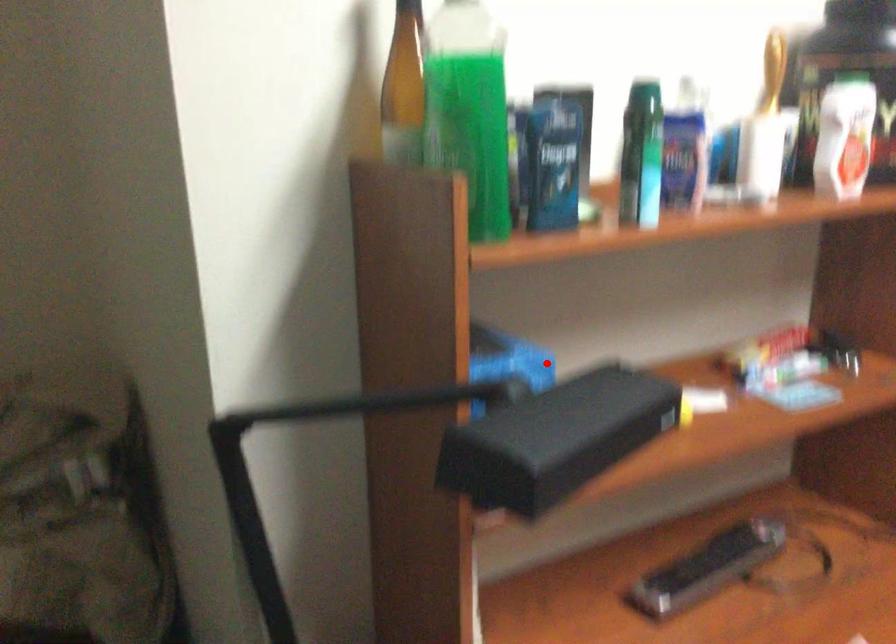
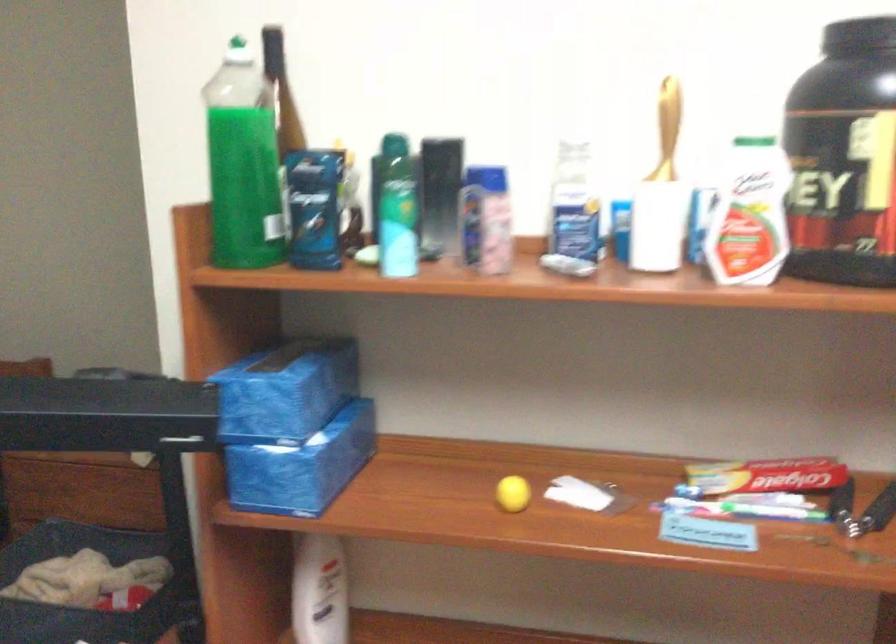
Locate, in the second image, the point that corresponds to the highlighted location in the first image.

(286, 391)